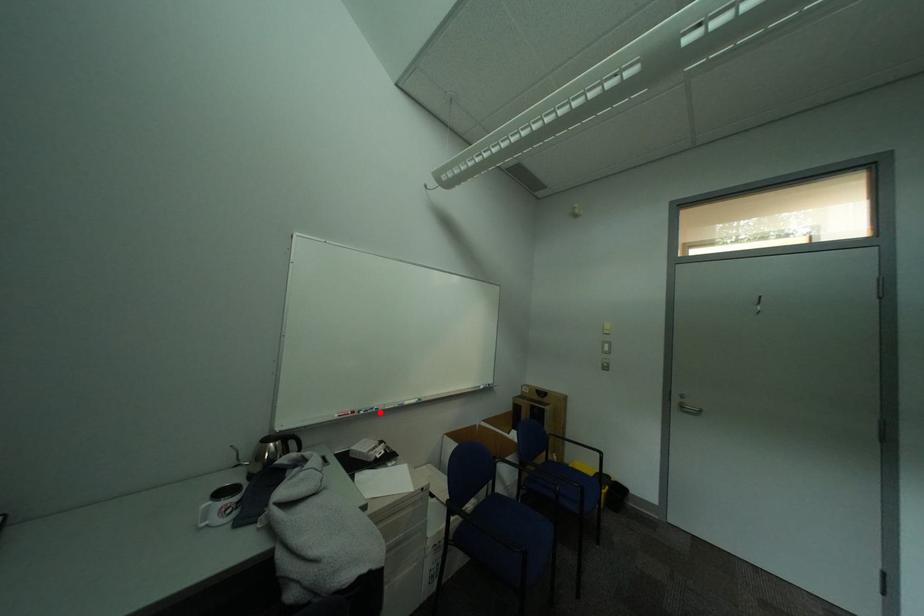
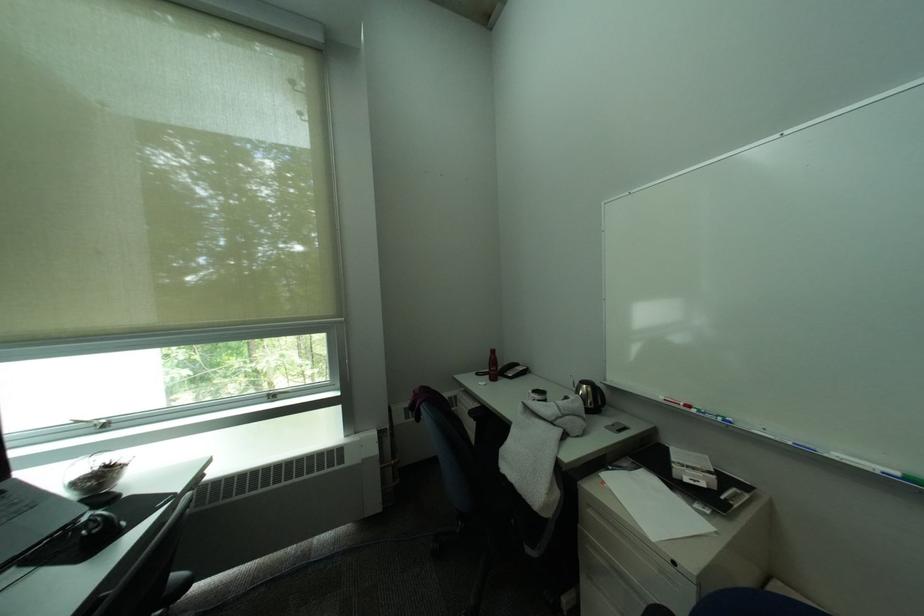
Locate, in the second image, the point that corresponds to the highlighted location in the first image.

(719, 416)